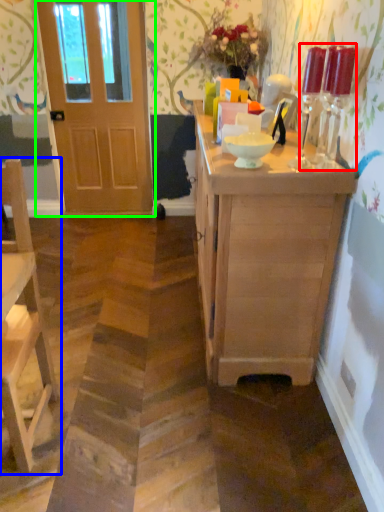
Question: Which object is the farthest from candle holder (highlighted by a red box)? Choose among these: chair (highlighted by a blue box) or door (highlighted by a green box).

Choices:
 (A) chair
 (B) door

Answer: (B)